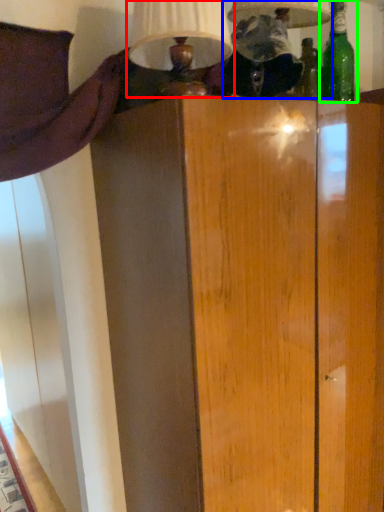
Question: Which is farther away from table lamp (highlighted by a red box)? table lamp (highlighted by a blue box) or bottle (highlighted by a green box)?

Choices:
 (A) table lamp
 (B) bottle

Answer: (B)